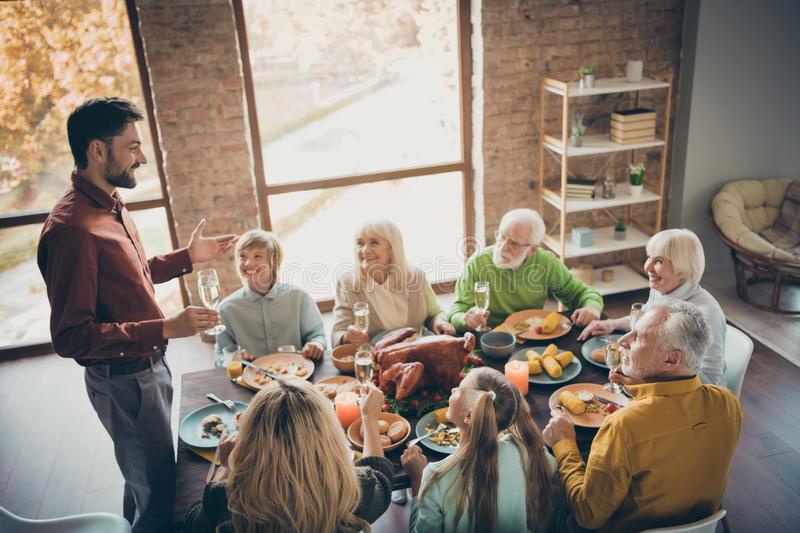
Locate an element on the screen. The height and width of the screenshot is (533, 800). plates is located at coordinates (526, 327), (582, 348), (578, 390), (426, 425), (538, 379), (281, 358), (204, 416), (426, 331).